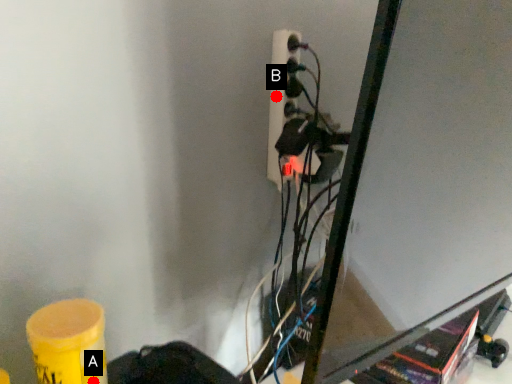
Question: Two points are circled on the image, labeled by A and B beside each circle. Which point is closer to the camera taking this photo?

Choices:
 (A) A is closer
 (B) B is closer

Answer: (A)